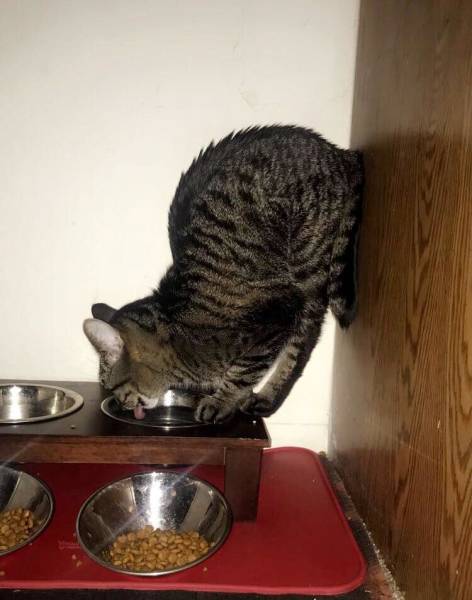
Locate an element on the screen. Image resolution: width=472 pixels, height=600 pixels. wall is located at coordinates (120, 140).